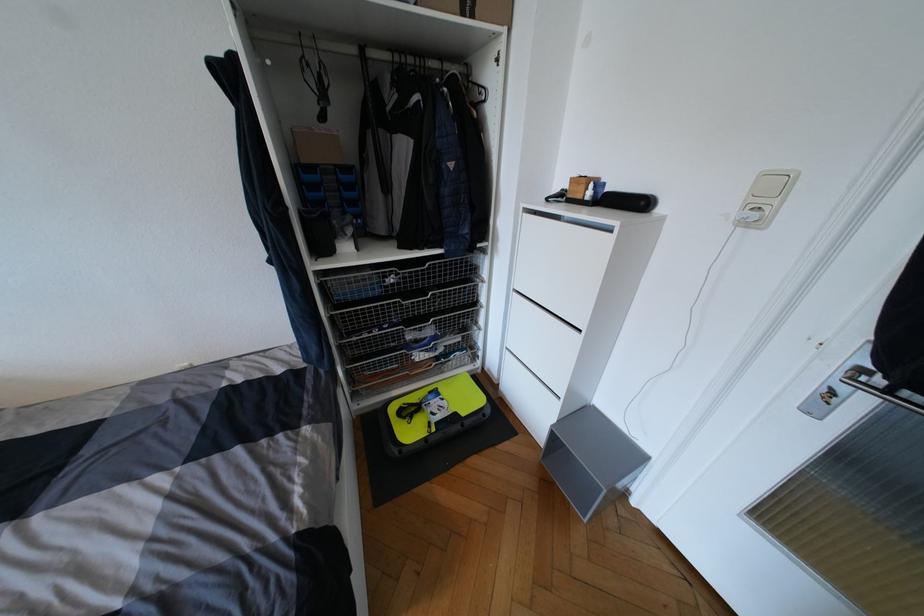
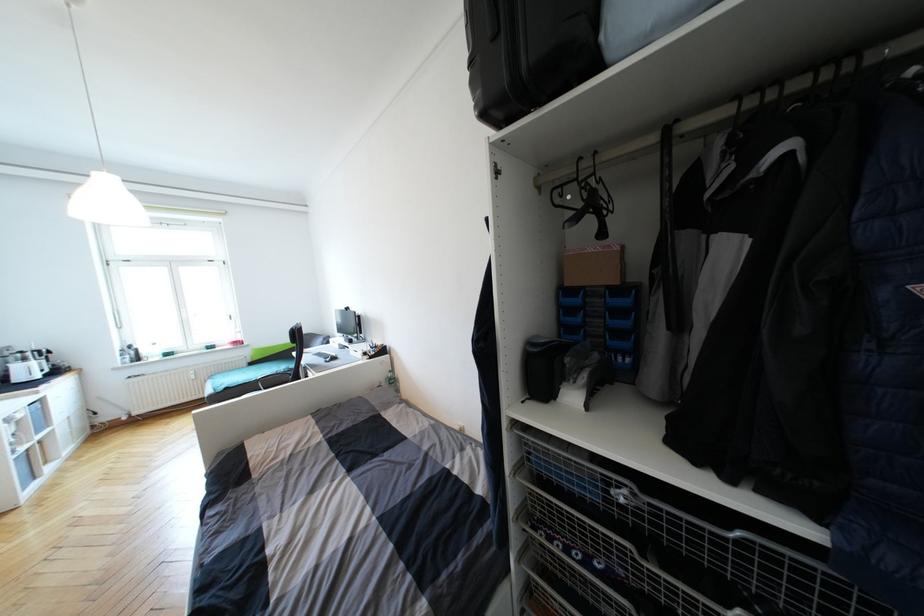
The point at [338,167] is marked in the first image. Where is the corresponding point in the second image?

(611, 288)